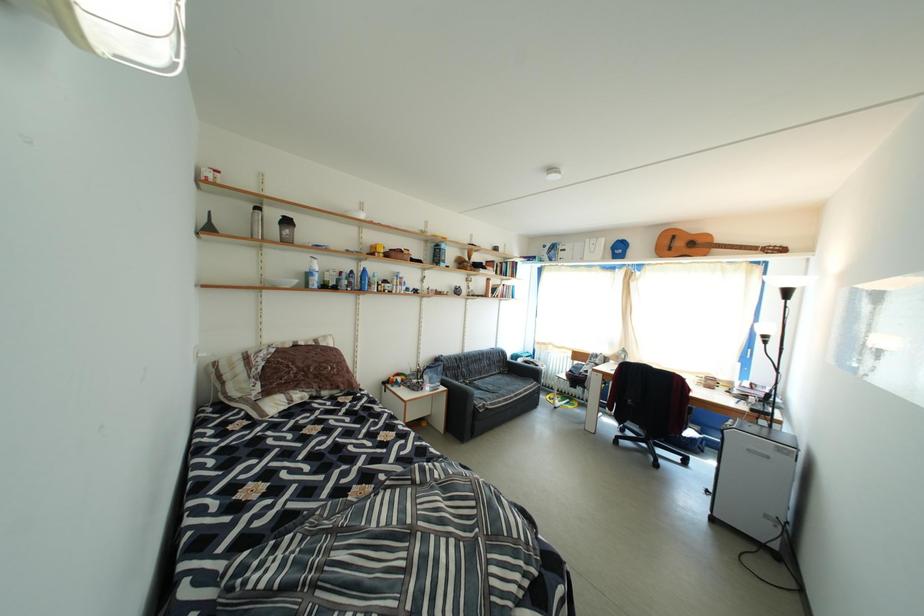
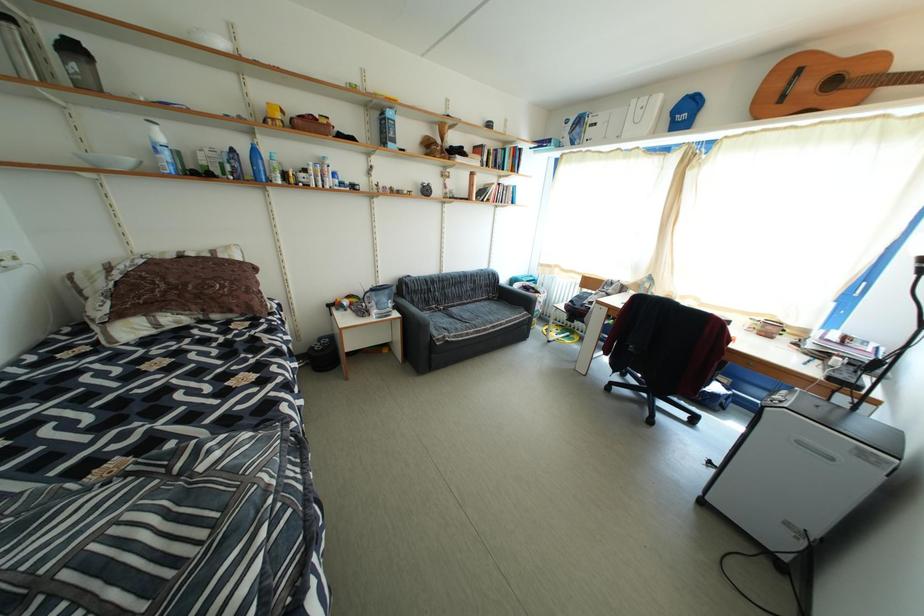
In a continuous first-person perspective shot, in which direction is the camera moving?

The movement direction of the cameraman is right, forward.